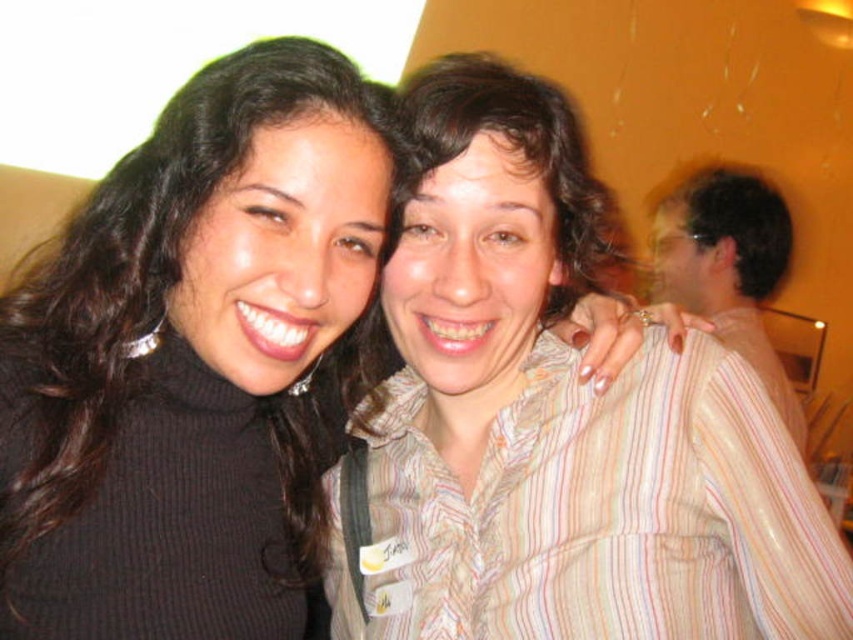
You are a photographer adjusting the lighting for a portrait. You notice two striped shirts in the frame. Which one is positioned to the left of the other? The striped cotton shirt at center and the striped shirt at right are both visible. Please identify the one on the left.

The striped cotton shirt at center is positioned to the left of the striped shirt at right.

You are taking a photo of two people standing in front of you. You notice two specific points in the image labeled as point 1 at coordinates point (502, 353) and point 2 at coordinates point (363, 88). Which point is closer to you?

Point (502, 353) is closer to you because it is further to the viewer than point (363, 88).